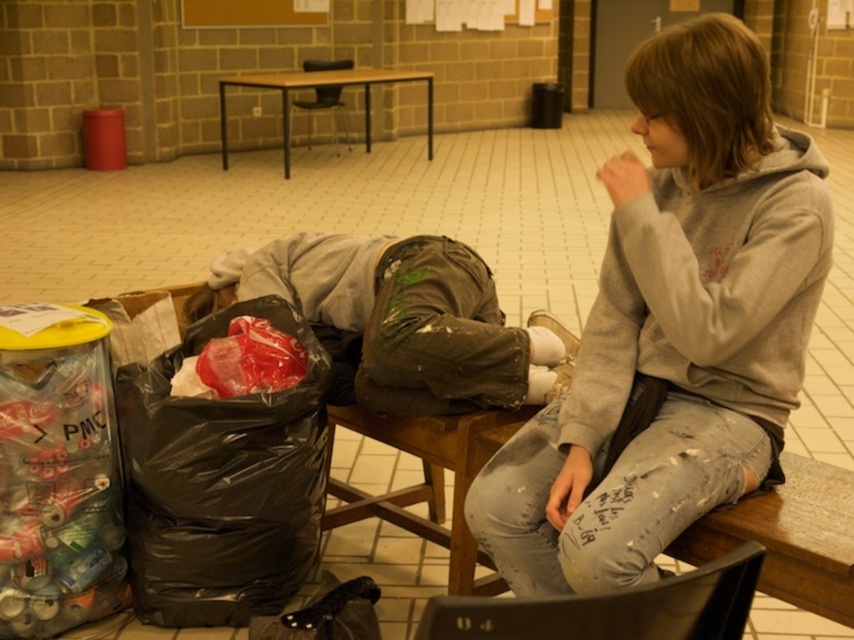
You are standing in the community center and want to place a small plant on the wooden table at center. The dirty gray pants at center is in the way. Can you move the plant to the table without disturbing the pants?

The dirty gray pants at center is closer to the viewer than the wooden table at center, so the pants are blocking the table. You would need to move the pants to access the table, but since they belong to a person lying down, it might be better to ask them first before moving anything.